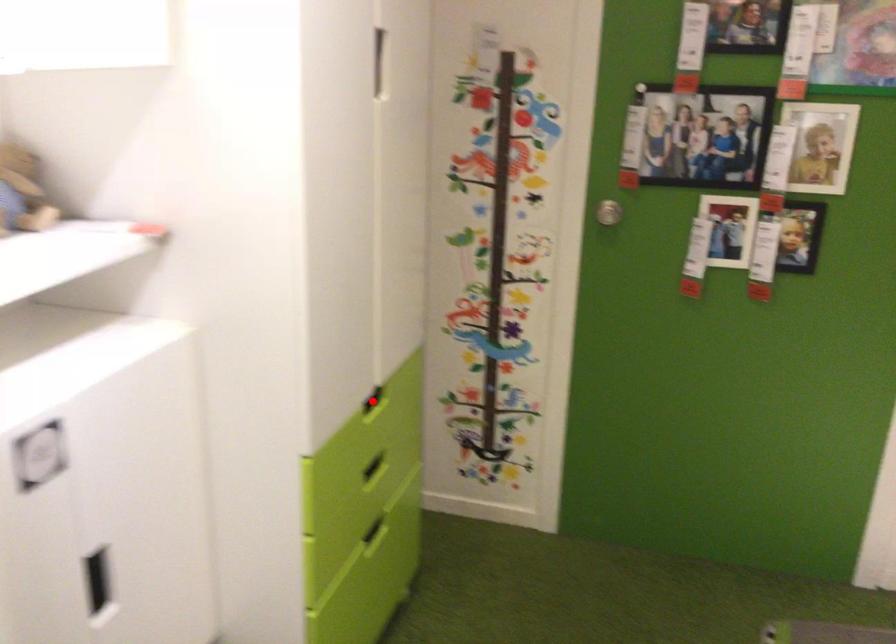
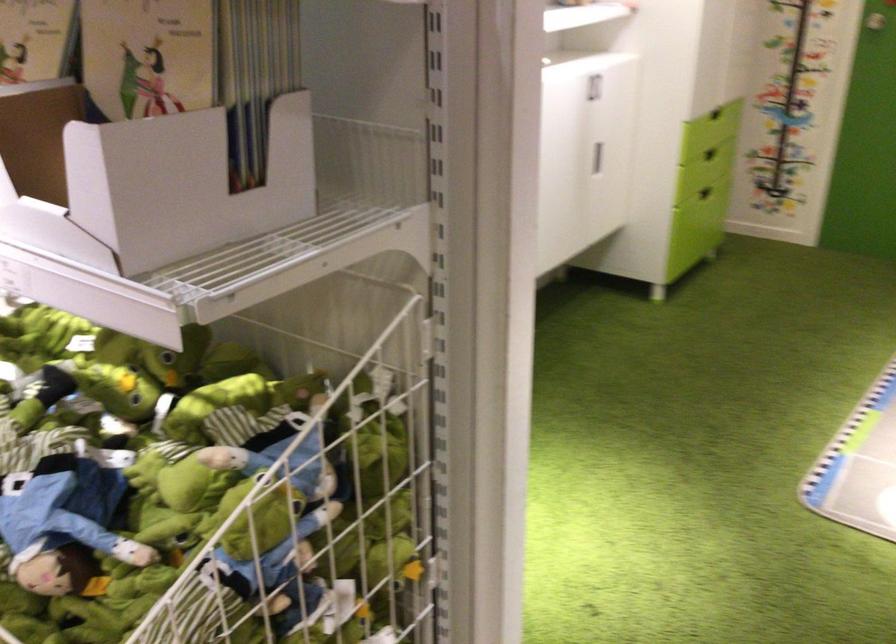
Question: I am providing you with two images of the same scene from different viewpoints. Image1 has a red point marked. In image2, the corresponding 3D location appears at what relative position? Reply with the corresponding letter.

Choices:
 (A) Closer
 (B) Farther

Answer: (B)